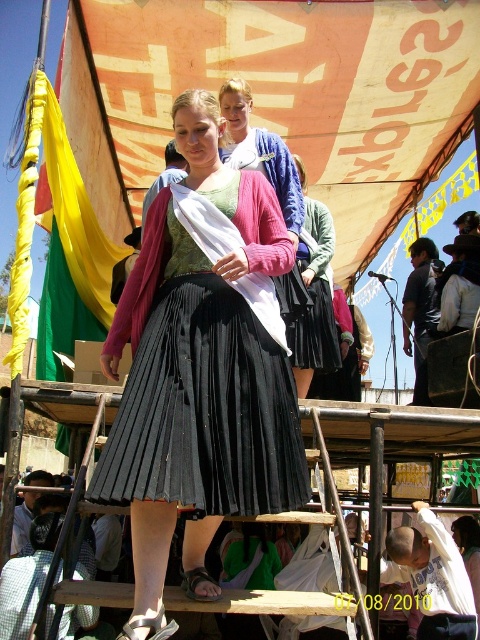
Question: In this image, where is black pleated skirt at center located relative to matte black skirt at center?

Choices:
 (A) above
 (B) below

Answer: (B)

Question: Which object is positioned farthest from the matte pink sweater at center?

Choices:
 (A) black pleated skirt at center
 (B) matte black skirt at center

Answer: (A)

Question: Which of the following is the closest to the observer?

Choices:
 (A) matte black skirt at center
 (B) matte pink sweater at center

Answer: (B)

Question: Does matte pink sweater at center have a greater width compared to matte black skirt at center?

Choices:
 (A) yes
 (B) no

Answer: (A)

Question: Is matte pink sweater at center bigger than matte black skirt at center?

Choices:
 (A) yes
 (B) no

Answer: (A)

Question: Among these points, which one is nearest to the camera?

Choices:
 (A) (257, 128)
 (B) (214, 497)
 (C) (321, 292)

Answer: (B)